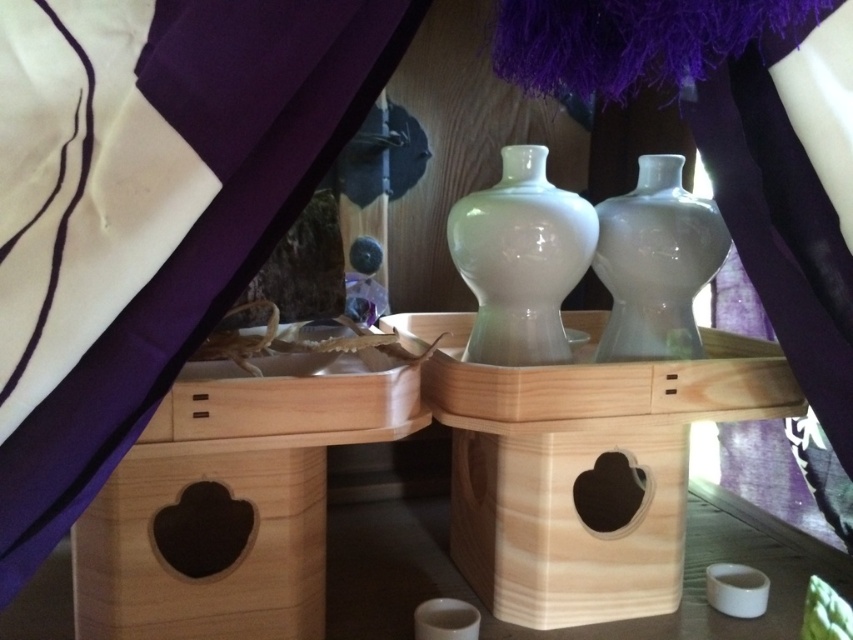
From the picture: You are setting up a traditional Japanese tea ceremony. You have a natural wood table at center and a transparent glass vase at center. According to the scene description, which object is positioned to the left of the other?

The natural wood table at center is to the left of the transparent glass vase at center.

You are a guest at a tea ceremony and want to admire the white glossy vase at center. However, you notice the purple fabric curtain at upper left is blocking your view. Can you move closer to see the vase better?

The purple fabric curtain at upper left is closer to the viewer than the white glossy vase at center, so moving closer might not help as the curtain is in front of the vase. You would need to move to the side or adjust your angle to see around the curtain.